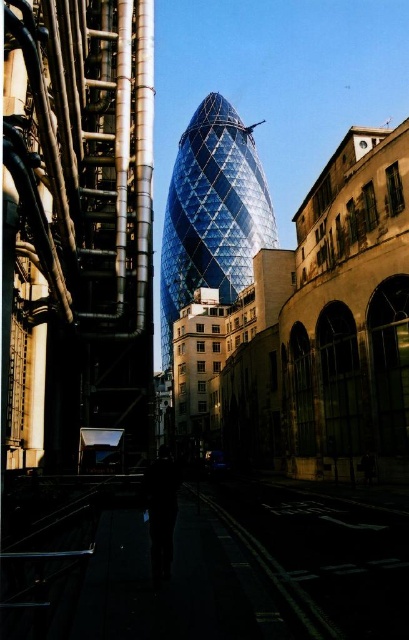
Identify the location of white reflective pavement at lower center. The width and height of the screenshot is (409, 640). (321, 556).